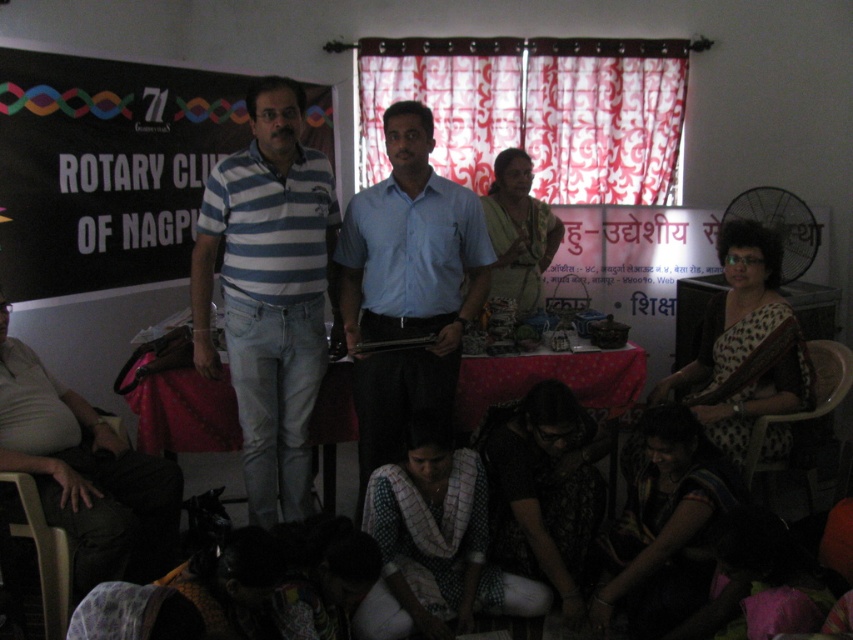
Question: Can you confirm if black fabric at upper left is bigger than light blue shirt at center?

Choices:
 (A) no
 (B) yes

Answer: (B)

Question: Among these points, which one is farthest from the camera?

Choices:
 (A) (524, 435)
 (B) (502, 161)
 (C) (202, 196)

Answer: (B)

Question: Which object appears farthest from the camera in this image?

Choices:
 (A) blue and white striped polo shirt at center
 (B) light blue shirt at center

Answer: (B)

Question: Can you confirm if white woven fabric at lower center is bigger than white dotted dress at right?

Choices:
 (A) yes
 (B) no

Answer: (B)

Question: Which of these objects is positioned farthest from the white woven fabric at lower center?

Choices:
 (A) dark brown fabric saree at lower center
 (B) beige fabric shirt at lower left

Answer: (B)

Question: Is dark brown fabric saree at lower center above dark printed fabric at lower center?

Choices:
 (A) no
 (B) yes

Answer: (A)